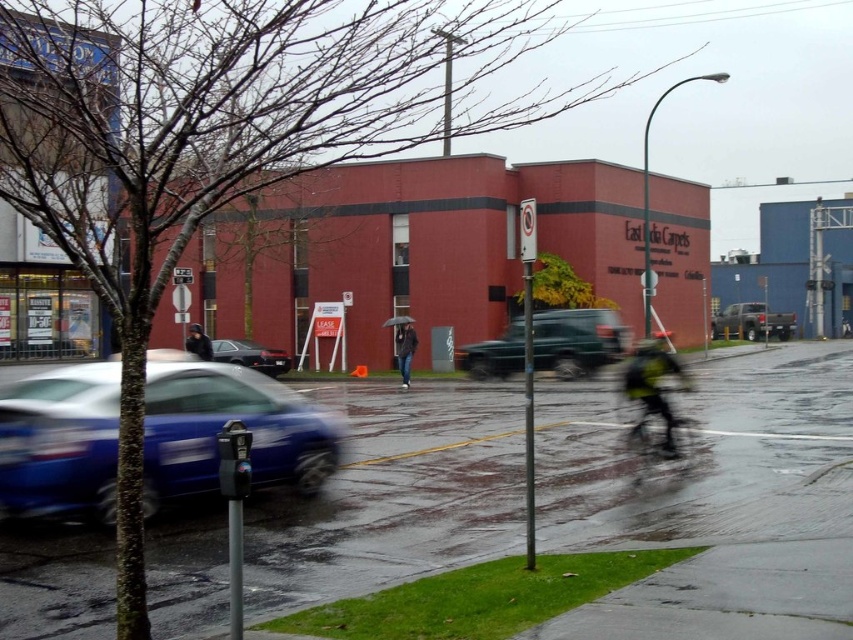
You are a pedestrian trying to cross the street safely. You see a matte green truck at right and dark blue jeans at center. Which object is closer to you?

The dark blue jeans at center is behind the matte green truck at right, so the matte green truck at right is closer to you.

You are standing on the wet asphalt road in the rainy scene and want to reach a specific location. You have two points to choose from. The first is point [50,513] and the second is point [282,364]. Which point is closer to you?

Point [50,513] is closer to the viewer than point [282,364].

You are a delivery person needing to cross the street from the matte green truck at right to the dark blue jeans at center. Given that your delivery vehicle has a turning radius of 12 meters, can you safely navigate the turn to reach the destination?

The distance between the matte green truck at right and the dark blue jeans at center is 33.86 meters. Since the turning radius required is 12 meters, the delivery vehicle can safely navigate the turn as the distance is sufficient for the maneuver.